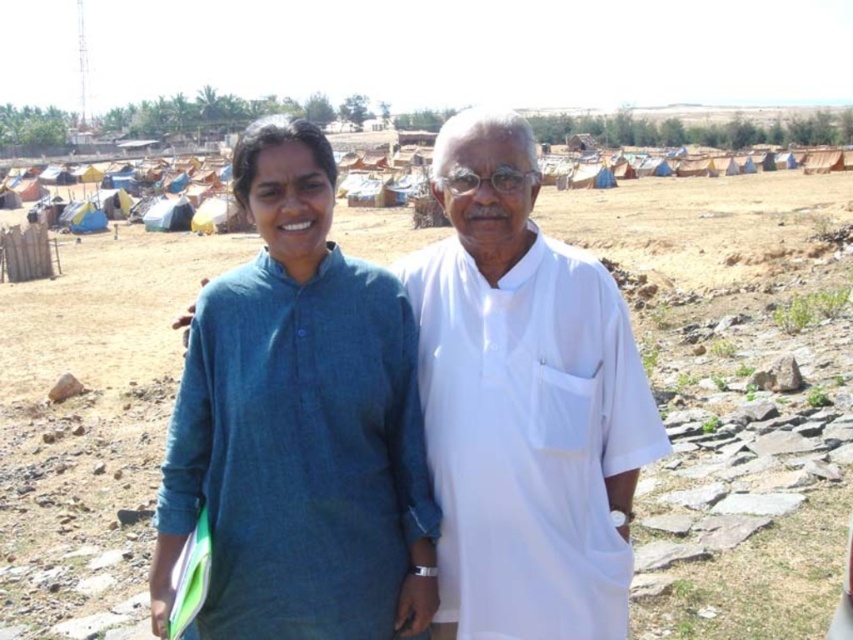
Question: Which of the following is the closest to the observer?

Choices:
 (A) (500, 161)
 (B) (718, 420)
 (C) (317, 374)

Answer: (C)

Question: Which point is farther to the camera?

Choices:
 (A) (619, 348)
 (B) (103, 420)
 (C) (305, 602)

Answer: (B)

Question: Can you confirm if brown soil at center is positioned to the right of denim shirt at center?

Choices:
 (A) no
 (B) yes

Answer: (B)

Question: Considering the real-world distances, which object is closest to the brown soil at center?

Choices:
 (A) denim shirt at center
 (B) white cotton kurta at center

Answer: (B)

Question: Where is brown soil at center located in relation to denim shirt at center in the image?

Choices:
 (A) below
 (B) above

Answer: (B)

Question: Does denim shirt at center appear on the left side of white cotton kurta at center?

Choices:
 (A) yes
 (B) no

Answer: (A)